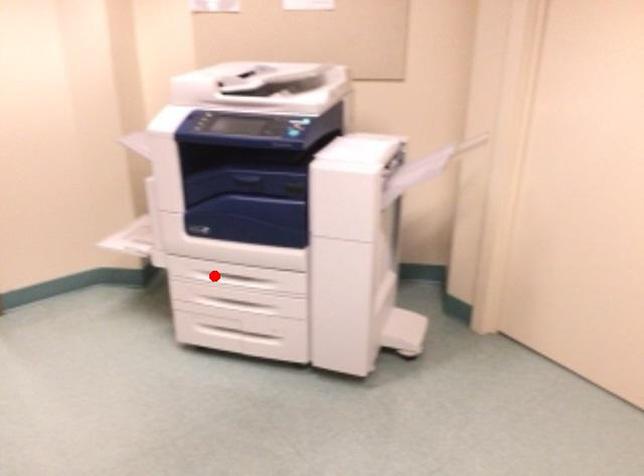
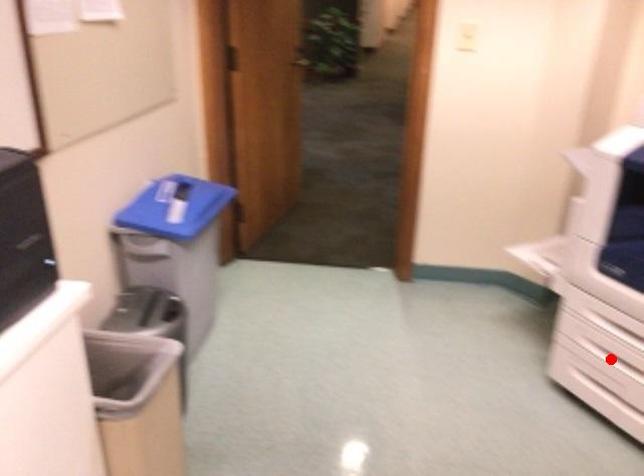
I am providing you with two images of the same scene from different viewpoints. A red point is marked on the first image and another point is marked on the second image. Is the marked point in image1 the same physical position as the marked point in image2?

No